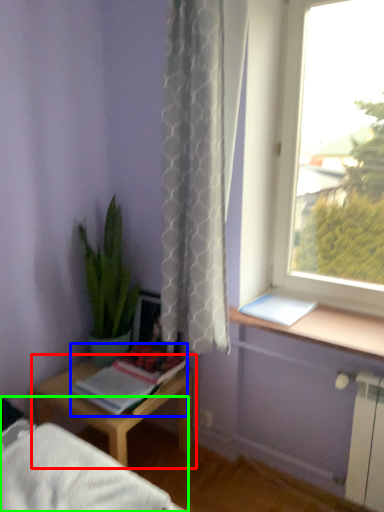
Question: Based on their relative distances, which object is farther from table (highlighted by a red box)? Choose from book (highlighted by a blue box) and bed frame (highlighted by a green box).

Choices:
 (A) book
 (B) bed frame

Answer: (B)